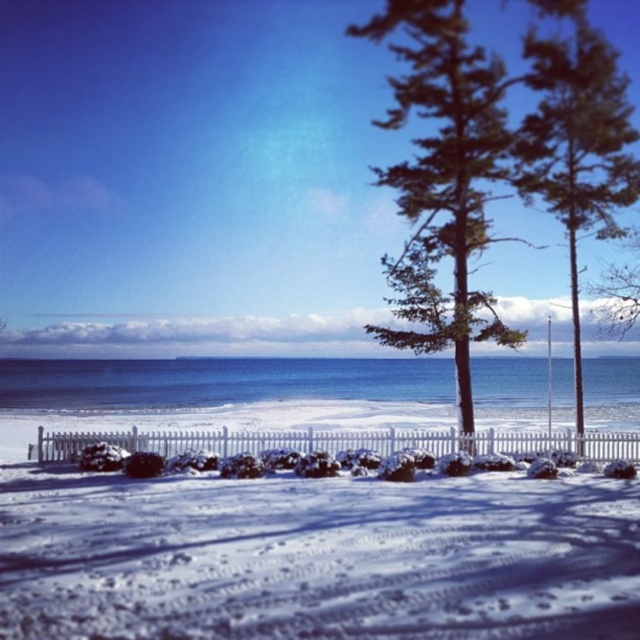
Question: Which of the following is the farthest from the observer?

Choices:
 (A) white snow at center
 (B) green needle-like foliage at upper right

Answer: (B)

Question: Does white snow at center appear over green needle-like foliage at upper right?

Choices:
 (A) yes
 (B) no

Answer: (B)

Question: Which is nearer to the green needle-like foliage at center?

Choices:
 (A) white snow at center
 (B) green needle-like foliage at upper right

Answer: (B)

Question: Does white snow at center appear on the left side of green needle-like foliage at center?

Choices:
 (A) yes
 (B) no

Answer: (A)

Question: From the image, what is the correct spatial relationship of white snow at center in relation to green needle-like foliage at center?

Choices:
 (A) right
 (B) left

Answer: (B)

Question: Which of the following is the closest to the observer?

Choices:
 (A) pos(456,122)
 (B) pos(536,67)

Answer: (A)